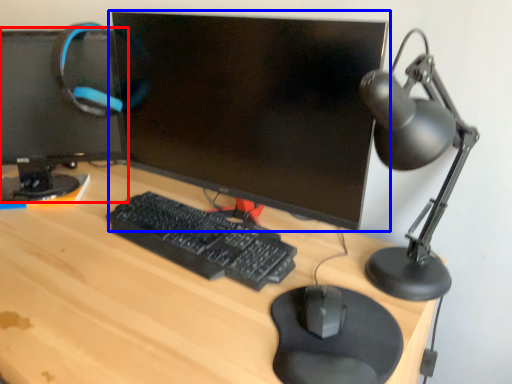
Question: Which object appears farthest to the camera in this image, computer monitor (highlighted by a red box) or computer monitor (highlighted by a blue box)?

Choices:
 (A) computer monitor
 (B) computer monitor

Answer: (A)